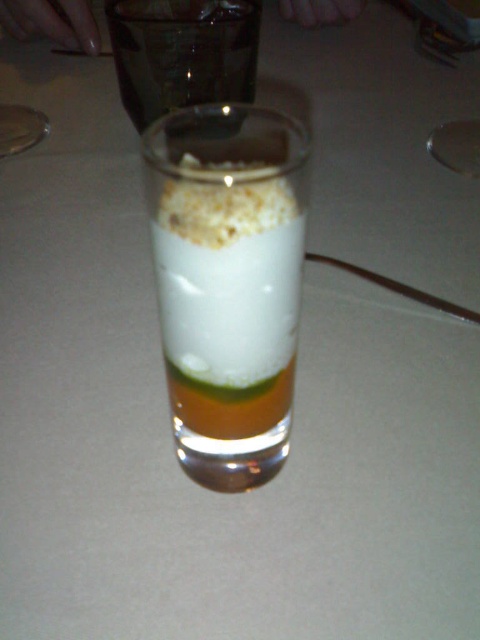
I want to click on translucent glass dessert at center, so click(x=228, y=282).

Can you confirm if translucent glass dessert at center is smaller than white creamy milk at center?

No, translucent glass dessert at center is not smaller than white creamy milk at center.

Between point (207, 310) and point (220, 317), which one is positioned behind?

The point (220, 317) is more distant.

This screenshot has width=480, height=640. I want to click on translucent glass dessert at center, so click(228, 282).

Can you confirm if translucent glass dessert at center is wider than transparent glass at upper center?

No, translucent glass dessert at center is not wider than transparent glass at upper center.

Is point (284, 164) closer to camera compared to point (208, 42)?

Yes.

Identify the location of translucent glass dessert at center. This screenshot has height=640, width=480. (228, 282).

Does point (257, 148) lie in front of point (213, 180)?

No, it is behind (213, 180).

Is translucent glass dessert at center thinner than white crumbly topping at center?

In fact, translucent glass dessert at center might be wider than white crumbly topping at center.

Is point (228, 188) less distant than point (160, 209)?

That is True.

At what (x,y) coordinates should I click in order to perform the action: click on translucent glass dessert at center. Please return your answer as a coordinate pair (x, y). The width and height of the screenshot is (480, 640). Looking at the image, I should click on (228, 282).